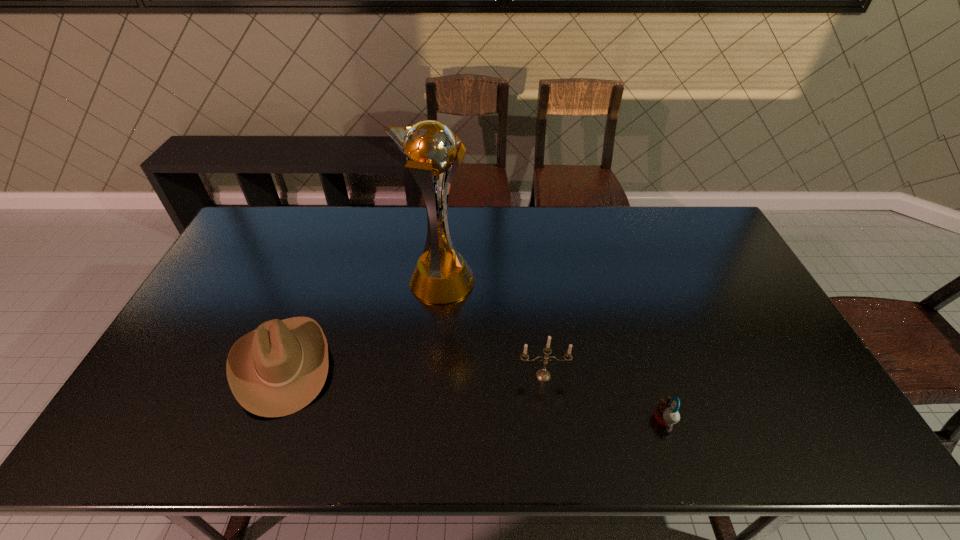
Locate an element on the screen. This screenshot has width=960, height=540. free area in between the third object from left to right and the second shortest object is located at coordinates (413, 370).

Select which object appears as the third closest to the cowboy hat. Please provide its 2D coordinates. Your answer should be formatted as a tuple, i.e. [(x, y)], where the tuple contains the x and y coordinates of a point satisfying the conditions above.

[(666, 414)]

Select which object appears as the third closest to the second tallest object. Please provide its 2D coordinates. Your answer should be formatted as a tuple, i.e. [(x, y)], where the tuple contains the x and y coordinates of a point satisfying the conditions above.

[(277, 369)]

Identify the location of vacant space that satisfies the following two spatial constraints: 1. on the front-facing side of the tallest object; 2. on the front side of the leftmost object. (432, 364).

The height and width of the screenshot is (540, 960). I want to click on free spot that satisfies the following two spatial constraints: 1. on the front-facing side of the trophy; 2. on the left side of the second tallest object, so (x=431, y=375).

Locate an element on the screen. vacant space that satisfies the following two spatial constraints: 1. on the front-facing side of the farthest object; 2. on the back side of the third shortest object is located at coordinates (431, 375).

Identify the location of vacant region that satisfies the following two spatial constraints: 1. on the front-facing side of the candle; 2. on the left side of the tallest object. This screenshot has height=540, width=960. (431, 375).